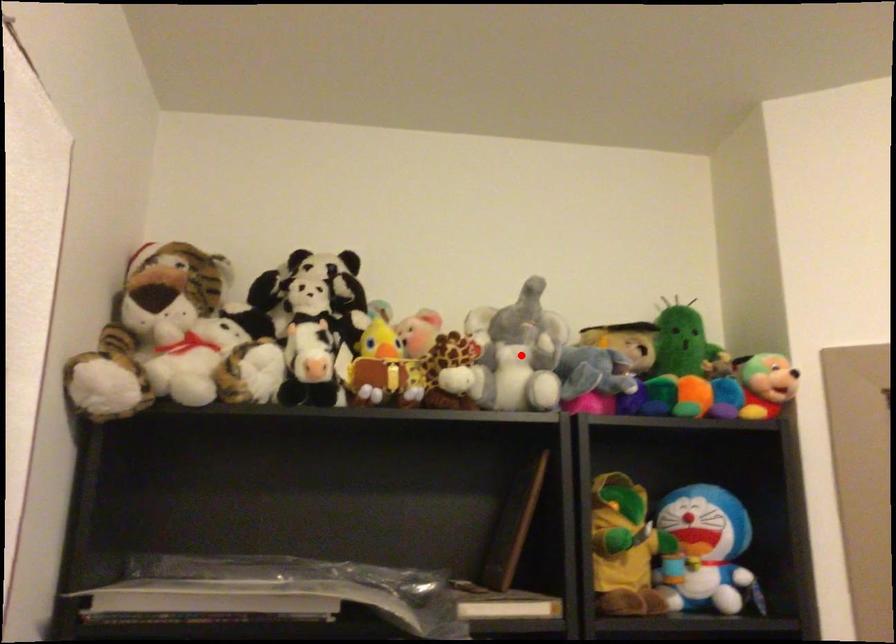
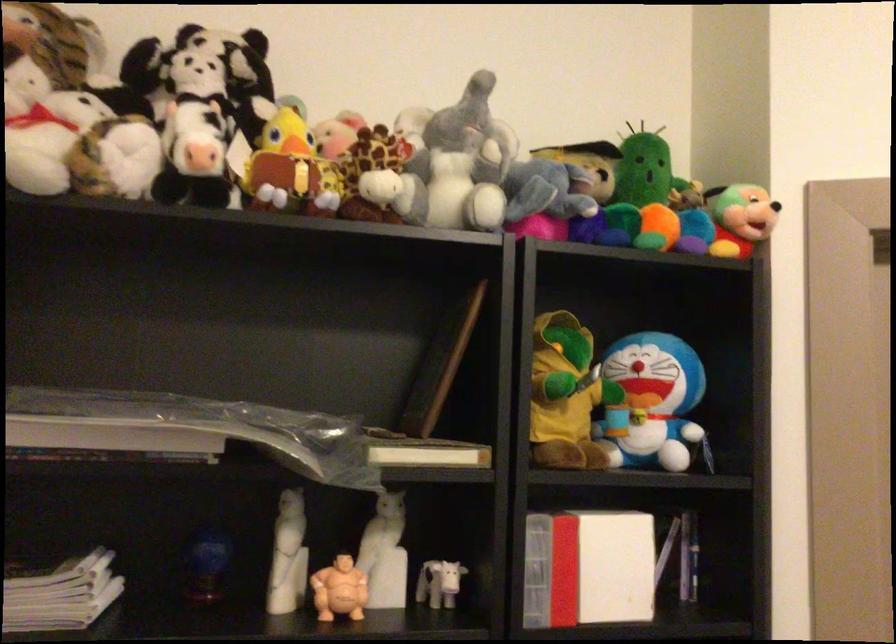
Locate, in the second image, the point that corresponds to the highlighted location in the first image.

(459, 165)